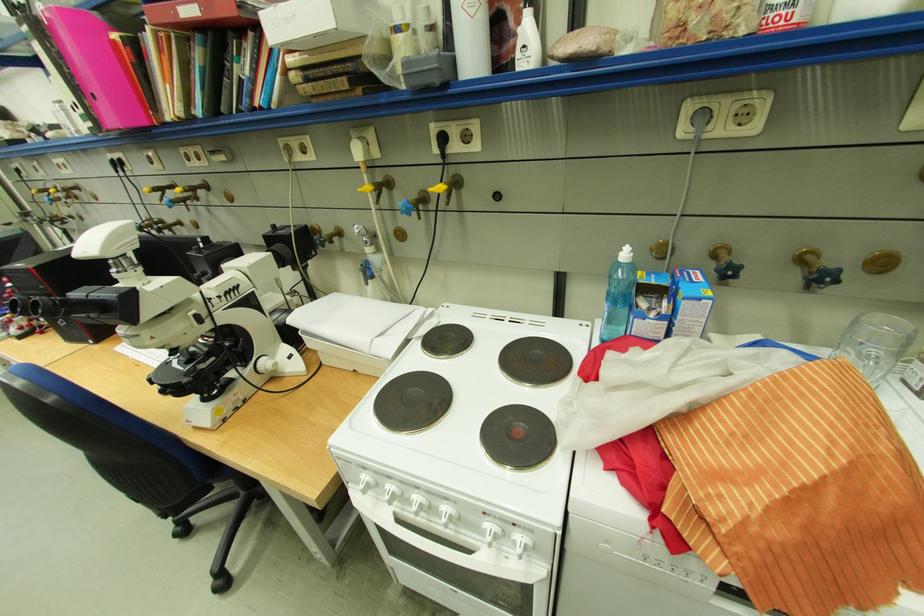
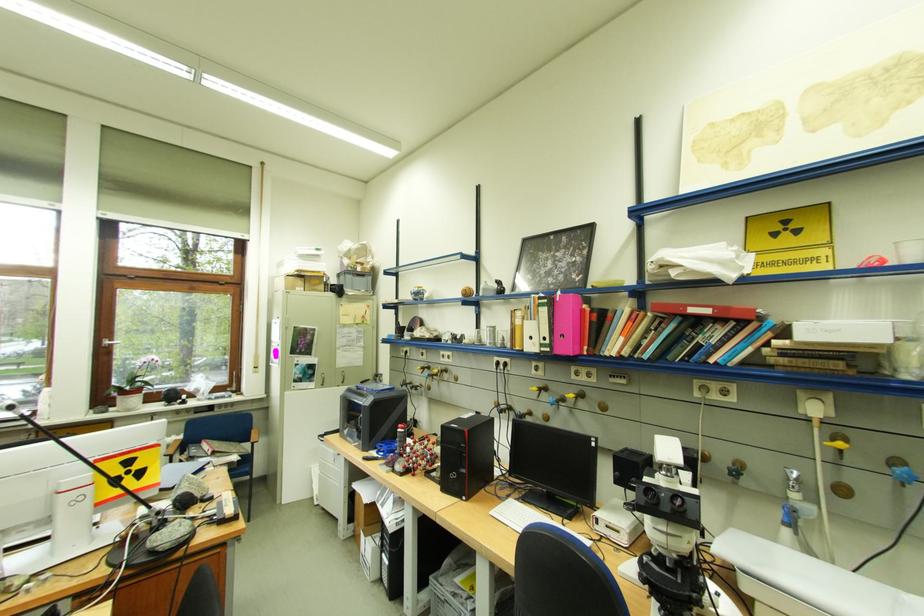
Where in the second image is the point corresponding to pixel 102 124 from the first image?

(558, 351)